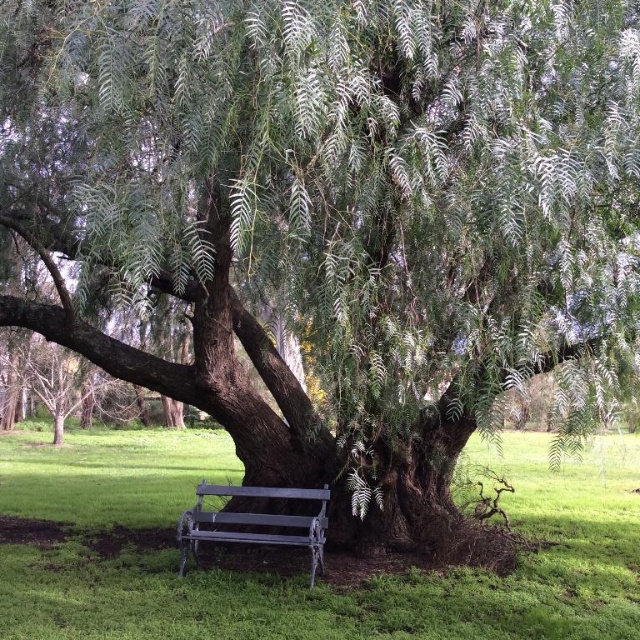
You are sitting on the metallic gray bench at lower center and want to place a small potted plant on the ground. If you want to put it on the green grass at lower center, which direction should you place it relative to the bench?

You should place the small potted plant to the right of the metallic gray bench at lower center because the green grass at lower center is located to the right of the bench.

You are a gardener who wants to mow the lawn. You see the green grass at lower center and the metallic gray bench at lower center. Which object should you avoid mowing?

You should avoid mowing the metallic gray bench at lower center because it is an object and the green grass at lower center is the area to mow.